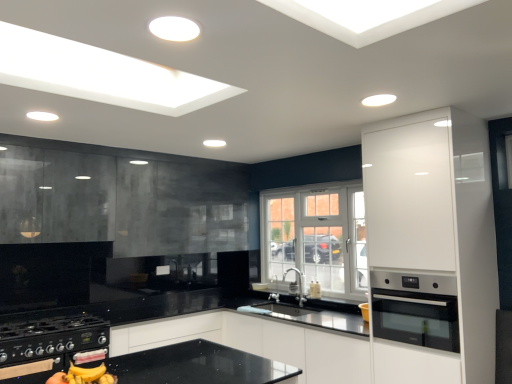
Question: Does satin nickel faucet at center have a greater width compared to stainless steel oven at right?

Choices:
 (A) no
 (B) yes

Answer: (A)

Question: Is satin nickel faucet at center smaller than stainless steel oven at right?

Choices:
 (A) no
 (B) yes

Answer: (B)

Question: Does satin nickel faucet at center turn towards stainless steel oven at right?

Choices:
 (A) yes
 (B) no

Answer: (B)

Question: Is stainless steel oven at right surrounded by satin nickel faucet at center?

Choices:
 (A) no
 (B) yes

Answer: (A)

Question: From the image's perspective, would you say satin nickel faucet at center is positioned over stainless steel oven at right?

Choices:
 (A) yes
 (B) no

Answer: (B)

Question: Is satin nickel faucet at center situated inside black matte gas stove at lower left or outside?

Choices:
 (A) inside
 (B) outside

Answer: (B)

Question: Considering the relative positions of satin nickel faucet at center and black matte gas stove at lower left in the image provided, is satin nickel faucet at center to the left or to the right of black matte gas stove at lower left?

Choices:
 (A) right
 (B) left

Answer: (A)

Question: Is point (291, 266) positioned closer to the camera than point (78, 362)?

Choices:
 (A) closer
 (B) farther

Answer: (B)

Question: Considering the positions of satin nickel faucet at center and black matte gas stove at lower left in the image, is satin nickel faucet at center wider or thinner than black matte gas stove at lower left?

Choices:
 (A) thin
 (B) wide

Answer: (A)

Question: From the image's perspective, relative to white glossy cabinet at right, the 2th cabinetry positioned from the left, is white textured window at center above or below?

Choices:
 (A) above
 (B) below

Answer: (B)

Question: From a real-world perspective, is white textured window at center above or below white glossy cabinet at right, acting as the first cabinetry starting from the right?

Choices:
 (A) above
 (B) below

Answer: (A)

Question: Considering the positions of point (270, 238) and point (401, 127), is point (270, 238) closer or farther from the camera than point (401, 127)?

Choices:
 (A) farther
 (B) closer

Answer: (A)

Question: Is white textured window at center inside or outside of white glossy cabinet at right, the 2th cabinetry positioned from the left?

Choices:
 (A) inside
 (B) outside

Answer: (B)

Question: In the image, is black matte gas stove at lower left positioned in front of or behind black glass cabinet at upper left, the 2th cabinetry from the front?

Choices:
 (A) front
 (B) behind

Answer: (A)

Question: Is black matte gas stove at lower left inside the boundaries of black glass cabinet at upper left, which is the first cabinetry from back to front, or outside?

Choices:
 (A) inside
 (B) outside

Answer: (B)